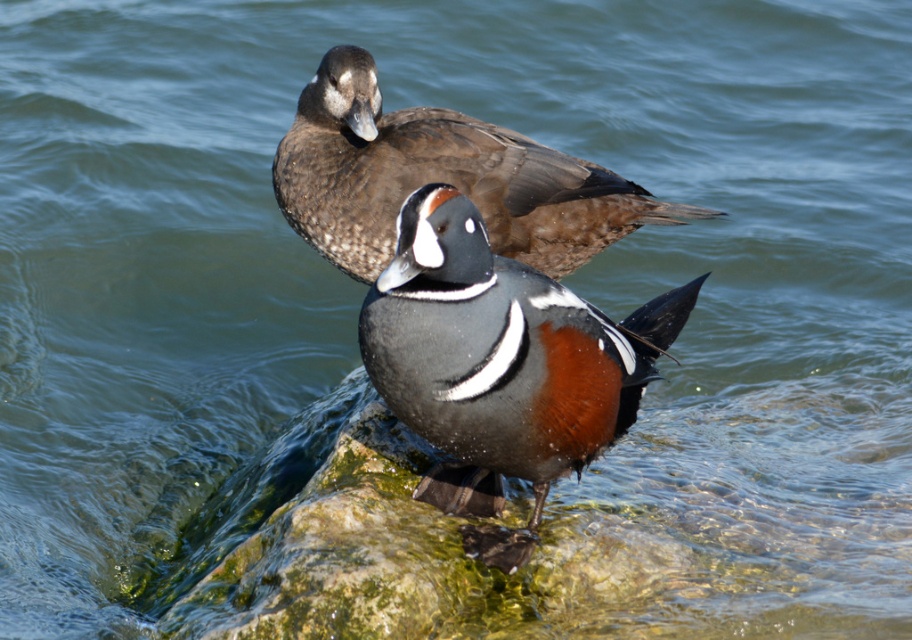
Question: Does matte black duck at center have a greater width compared to brown speckled duck at upper center?

Choices:
 (A) no
 (B) yes

Answer: (A)

Question: Is matte black duck at center smaller than brown speckled duck at upper center?

Choices:
 (A) yes
 (B) no

Answer: (B)

Question: Which point is closer to the camera?

Choices:
 (A) (625, 212)
 (B) (617, 388)

Answer: (B)

Question: Does matte black duck at center lie behind brown speckled duck at upper center?

Choices:
 (A) no
 (B) yes

Answer: (A)

Question: Which object appears farthest from the camera in this image?

Choices:
 (A) matte black duck at center
 (B) brown speckled duck at upper center

Answer: (B)

Question: Among these objects, which one is nearest to the camera?

Choices:
 (A) matte black duck at center
 (B) brown speckled duck at upper center

Answer: (A)